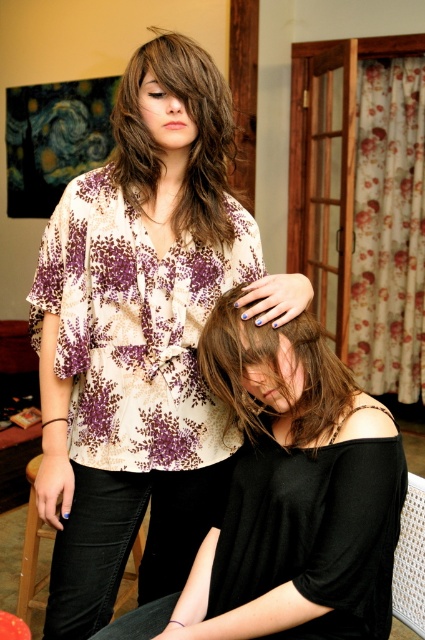
Question: Is matte floral blouse at center to the left of brown matte hair at center from the viewer's perspective?

Choices:
 (A) yes
 (B) no

Answer: (A)

Question: Which object appears closest to the camera in this image?

Choices:
 (A) black matte hair at center
 (B) dark brown wavy hair at upper center
 (C) woven fabric chair at lower right

Answer: (A)

Question: Considering the relative positions of black matte hair at center and dark brown wavy hair at upper center in the image provided, where is black matte hair at center located with respect to dark brown wavy hair at upper center?

Choices:
 (A) below
 (B) above

Answer: (A)

Question: Is matte floral blouse at center bigger than black leather chair at lower left?

Choices:
 (A) yes
 (B) no

Answer: (A)

Question: Which point is closer to the camera taking this photo?

Choices:
 (A) (424, 481)
 (B) (223, 419)
 (C) (302, 336)
 (D) (28, 563)

Answer: (C)

Question: Which object appears closest to the camera in this image?

Choices:
 (A) black leather chair at lower left
 (B) dark brown wavy hair at upper center
 (C) woven fabric chair at lower right
 (D) brown matte hair at center

Answer: (D)